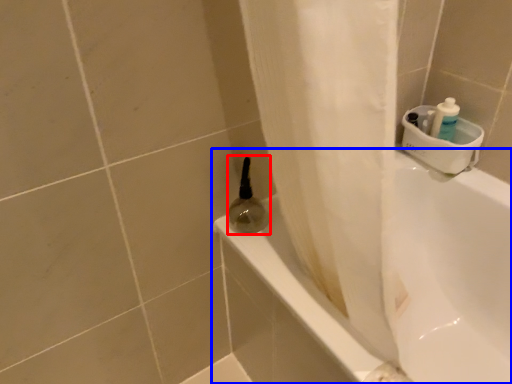
Question: Among these objects, which one is nearest to the camera, mouthwash (highlighted by a red box) or bathtub (highlighted by a blue box)?

Choices:
 (A) mouthwash
 (B) bathtub

Answer: (B)